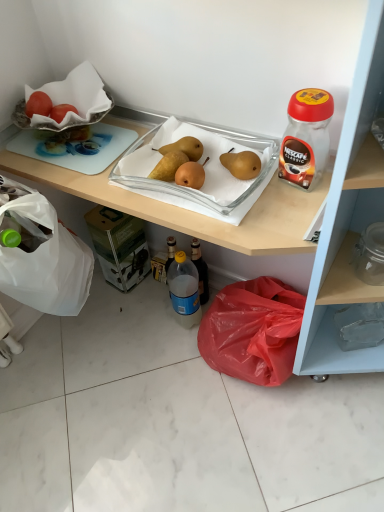
Describe the element at coordinates (181, 163) in the screenshot. The image size is (384, 512). I see `yellow matte pears at center` at that location.

Where is `yellow matte pears at center`? This screenshot has width=384, height=512. yellow matte pears at center is located at coordinates (181, 163).

This screenshot has width=384, height=512. What do you see at coordinates (306, 137) in the screenshot? I see `transparent plastic jar at upper right, which is the first bottle from front to back` at bounding box center [306, 137].

Locate an element on the screen. The image size is (384, 512). matte plastic cabinet at lower right is located at coordinates (244, 94).

Find the location of `bottle that is on the left side of matte plastic cabinet at lower right`. bottle that is on the left side of matte plastic cabinet at lower right is located at coordinates (184, 290).

From a real-world perspective, is blue translucent bottle at center, the 2th bottle positioned from the top, on matte plastic cabinet at lower right?

Incorrect, from a real-world perspective, blue translucent bottle at center, the 2th bottle positioned from the top, is lower than matte plastic cabinet at lower right.

Can you confirm if blue translucent bottle at center, which is the first bottle from bottom to top, is bigger than matte plastic cabinet at lower right?

No, blue translucent bottle at center, which is the first bottle from bottom to top, is not bigger than matte plastic cabinet at lower right.

Is blue translucent bottle at center, the second bottle when ordered from right to left, facing towards matte plastic cabinet at lower right?

Yes, blue translucent bottle at center, the second bottle when ordered from right to left, faces towards matte plastic cabinet at lower right.

Does transparent plastic jar at upper right, arranged as the second bottle when ordered from the bottom, lie in front of matte plastic cabinet at lower right?

No, transparent plastic jar at upper right, arranged as the second bottle when ordered from the bottom, is further to the viewer.

Which point is more distant from viewer, (305, 184) or (190, 80)?

The point (190, 80) is farther from the camera.

Between transparent plastic jar at upper right, marked as the first bottle in a right-to-left arrangement, and matte plastic cabinet at lower right, which one appears on the right side from the viewer's perspective?

Positioned to the right is transparent plastic jar at upper right, marked as the first bottle in a right-to-left arrangement.

Based on the photo, can we say transparent plastic jar at upper right, which is the first bottle from front to back, lies outside matte plastic cabinet at lower right?

No, transparent plastic jar at upper right, which is the first bottle from front to back, is inside matte plastic cabinet at lower right's boundary.

Is smooth red tomato at upper left positioned with its back to yellow matte pears at center?

smooth red tomato at upper left is not turned away from yellow matte pears at center.

Does smooth red tomato at upper left appear on the left side of yellow matte pears at center?

Correct, you'll find smooth red tomato at upper left to the left of yellow matte pears at center.

Between point (61, 106) and point (193, 139), which one is positioned behind?

The point (61, 106) is farther from the camera.

From the image's perspective, who appears lower, blue translucent bottle at center, the second bottle when ordered from front to back, or yellow matte pears at center?

From the image's view, blue translucent bottle at center, the second bottle when ordered from front to back, is below.

Which of these two, blue translucent bottle at center, the second bottle when ordered from front to back, or yellow matte pears at center, stands taller?

blue translucent bottle at center, the second bottle when ordered from front to back, is taller.

Looking at this image, is blue translucent bottle at center, which appears as the 1th bottle when viewed from the back, oriented towards yellow matte pears at center?

No, blue translucent bottle at center, which appears as the 1th bottle when viewed from the back, is not turned towards yellow matte pears at center.

Locate an element on the screen. The height and width of the screenshot is (512, 384). bottle located behind the yellow matte pears at center is located at coordinates (184, 290).

Which of these two, matte plastic cabinet at lower right or smooth red tomato at upper left, is bigger?

matte plastic cabinet at lower right.

Who is more distant, matte plastic cabinet at lower right or smooth red tomato at upper left?

Positioned behind is smooth red tomato at upper left.

Identify the location of fruit on the left of matte plastic cabinet at lower right. (61, 111).

From a real-world perspective, is matte plastic cabinet at lower right on smooth red tomato at upper left?

No, from a real-world perspective, matte plastic cabinet at lower right is not on top of smooth red tomato at upper left.

Considering the sizes of objects matte plastic cabinet at lower right and blue translucent bottle at center, which appears as the 1th bottle when viewed from the back, in the image provided, who is taller, matte plastic cabinet at lower right or blue translucent bottle at center, which appears as the 1th bottle when viewed from the back,?

With more height is matte plastic cabinet at lower right.

Where is `cabinetry that is in front of the blue translucent bottle at center, which is the first bottle from bottom to top`? cabinetry that is in front of the blue translucent bottle at center, which is the first bottle from bottom to top is located at coordinates (244, 94).

Is matte plastic cabinet at lower right not inside blue translucent bottle at center, arranged as the 1th bottle when viewed from the left?

Yes, matte plastic cabinet at lower right is outside of blue translucent bottle at center, arranged as the 1th bottle when viewed from the left.

Is the depth of matte plastic cabinet at lower right less than that of blue translucent bottle at center, arranged as the 1th bottle when viewed from the left?

Yes.

Considering the relative sizes of smooth red tomato at upper left and matte plastic cabinet at lower right in the image provided, is smooth red tomato at upper left wider than matte plastic cabinet at lower right?

Incorrect, the width of smooth red tomato at upper left does not surpass that of matte plastic cabinet at lower right.

From the picture: Between smooth red tomato at upper left and matte plastic cabinet at lower right, which one appears on the right side from the viewer's perspective?

matte plastic cabinet at lower right.

Would you consider smooth red tomato at upper left to be distant from matte plastic cabinet at lower right?

No, smooth red tomato at upper left is not far away from matte plastic cabinet at lower right.

I want to click on cabinetry that appears in front of the blue translucent bottle at center, the second bottle when ordered from front to back, so click(244, 94).

Find the location of a particular element. cabinetry on the left of transparent plastic jar at upper right, marked as the first bottle in a right-to-left arrangement is located at coordinates (244, 94).

Estimate the real-world distances between objects in this image. Which object is further from transparent plastic jar at upper right, the first bottle positioned from the top, blue translucent bottle at center, the second bottle when ordered from right to left, or yellow matte pears at center?

The object further to transparent plastic jar at upper right, the first bottle positioned from the top, is blue translucent bottle at center, the second bottle when ordered from right to left.

When comparing their distances from smooth red tomato at upper left, does matte plastic cabinet at lower right or transparent plastic jar at upper right, arranged as the second bottle when ordered from the bottom, seem closer?

Based on the image, matte plastic cabinet at lower right appears to be nearer to smooth red tomato at upper left.

Based on their spatial positions, is transparent plastic jar at upper right, the 2th bottle in the back-to-front sequence, or yellow matte pears at center further from blue translucent bottle at center, the 2th bottle positioned from the top?

transparent plastic jar at upper right, the 2th bottle in the back-to-front sequence, lies further to blue translucent bottle at center, the 2th bottle positioned from the top, than the other object.

Based on the photo, based on their spatial positions, is transparent plastic jar at upper right, marked as the first bottle in a right-to-left arrangement, or smooth red tomato at upper left further from blue translucent bottle at center, arranged as the 1th bottle when viewed from the left?

smooth red tomato at upper left is further to blue translucent bottle at center, arranged as the 1th bottle when viewed from the left.

When comparing their distances from transparent plastic jar at upper right, the 2th bottle when ordered from left to right, does yellow matte pears at center or blue translucent bottle at center, arranged as the 1th bottle when viewed from the left, seem further?

The object further to transparent plastic jar at upper right, the 2th bottle when ordered from left to right, is blue translucent bottle at center, arranged as the 1th bottle when viewed from the left.

Looking at the image, which one is located further to yellow matte pears at center, transparent plastic jar at upper right, the 2th bottle when ordered from left to right, or smooth red tomato at upper left?

smooth red tomato at upper left is further to yellow matte pears at center.

Considering their positions, is matte plastic cabinet at lower right positioned further to blue translucent bottle at center, which is the first bottle from bottom to top, than smooth red tomato at upper left?

Based on the image, smooth red tomato at upper left appears to be further to blue translucent bottle at center, which is the first bottle from bottom to top.

Considering their positions, is blue translucent bottle at center, which appears as the 1th bottle when viewed from the back, positioned closer to matte plastic cabinet at lower right than smooth red tomato at upper left?

smooth red tomato at upper left lies closer to matte plastic cabinet at lower right than the other object.

Image resolution: width=384 pixels, height=512 pixels. What are the coordinates of `food between matte plastic cabinet at lower right and smooth red tomato at upper left from front to back` in the screenshot? It's located at (181, 163).

Locate an element on the screen. fruit positioned between matte plastic cabinet at lower right and blue translucent bottle at center, the second bottle when ordered from right to left, from near to far is located at coordinates (61, 111).

Where is `food located between transparent plastic jar at upper right, marked as the first bottle in a right-to-left arrangement, and blue translucent bottle at center, arranged as the 1th bottle when viewed from the left, in the depth direction`? The width and height of the screenshot is (384, 512). food located between transparent plastic jar at upper right, marked as the first bottle in a right-to-left arrangement, and blue translucent bottle at center, arranged as the 1th bottle when viewed from the left, in the depth direction is located at coordinates (181, 163).

Where is `food between smooth red tomato at upper left and blue translucent bottle at center, the 2th bottle positioned from the top, vertically`? food between smooth red tomato at upper left and blue translucent bottle at center, the 2th bottle positioned from the top, vertically is located at coordinates (181, 163).